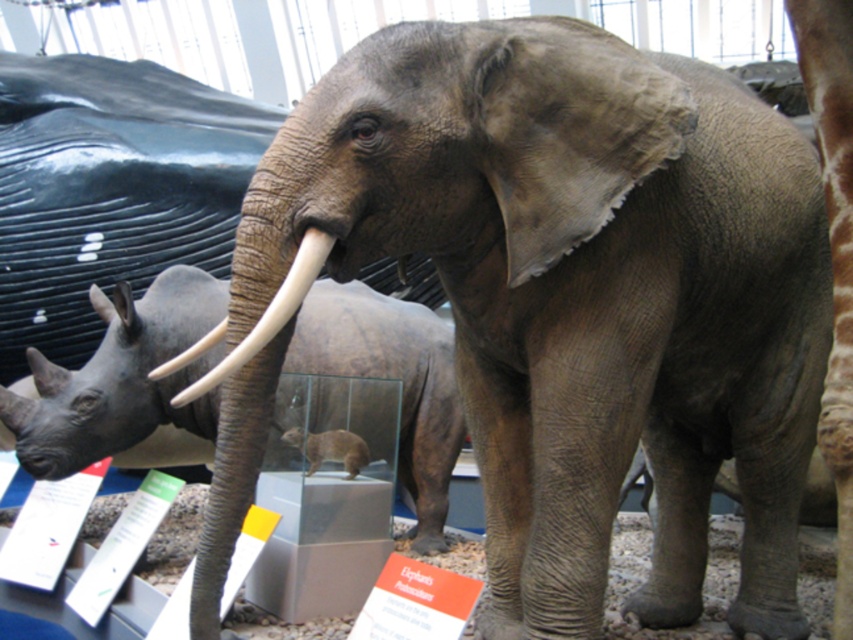
Question: Can you confirm if matte gray rhinoceros at center is wider than white ivory tusk at center?

Choices:
 (A) no
 (B) yes

Answer: (B)

Question: Can you confirm if matte gray rhinoceros at center is smaller than white ivory tusk at center?

Choices:
 (A) no
 (B) yes

Answer: (A)

Question: Which point is closer to the camera?

Choices:
 (A) (305, 289)
 (B) (437, 436)

Answer: (A)

Question: Which point is closer to the camera taking this photo?

Choices:
 (A) tap(200, 365)
 (B) tap(308, 289)

Answer: (B)

Question: Can you confirm if matte gray rhinoceros at center is positioned below white ivory tusk at center?

Choices:
 (A) no
 (B) yes

Answer: (B)